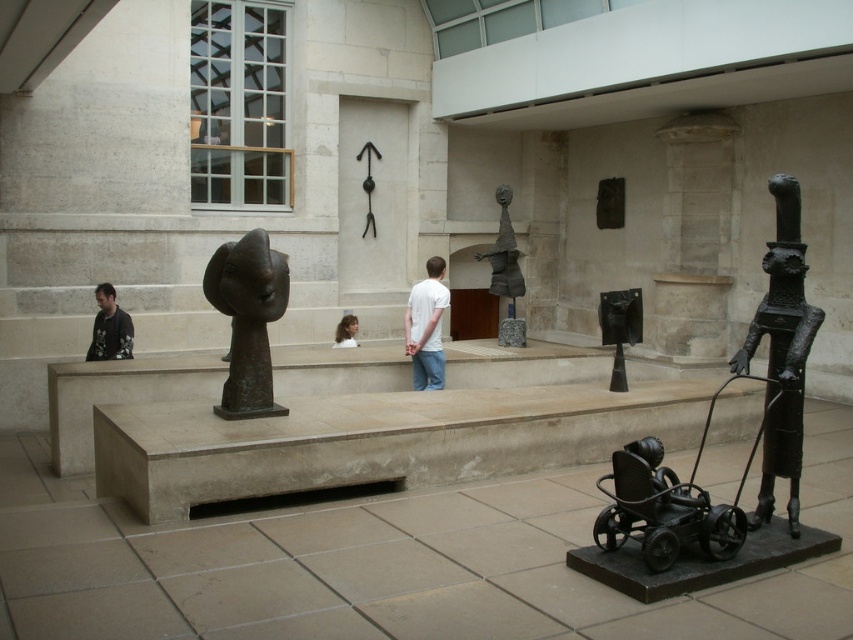
From the picture: Does white matte shirt at center appear under polished bronze sculpture at center?

No.

Does point (438, 332) lie behind point (628, 294)?

Yes, it is.

Who is more forward, (x=437, y=296) or (x=630, y=328)?

Point (x=630, y=328) is more forward.

The height and width of the screenshot is (640, 853). Find the location of `white matte shirt at center`. white matte shirt at center is located at coordinates (426, 326).

Who is more distant from viewer, [498,257] or [350,336]?

Positioned behind is point [498,257].

Who is shorter, polished bronze figure at center or smooth brown hair at center?

With less height is smooth brown hair at center.

Who is more distant from viewer, (508, 278) or (355, 316)?

The point (355, 316) is more distant.

Locate an element on the screen. polished bronze figure at center is located at coordinates (503, 252).

Can you confirm if bronze sculpture at center is wider than white matte shirt at center?

Correct, the width of bronze sculpture at center exceeds that of white matte shirt at center.

Which is in front, point (264, 358) or point (436, 257)?

Point (264, 358) is in front.

What do you see at coordinates (247, 320) in the screenshot? This screenshot has width=853, height=640. I see `bronze sculpture at center` at bounding box center [247, 320].

Where is `bronze sculpture at center`? The height and width of the screenshot is (640, 853). bronze sculpture at center is located at coordinates (247, 320).